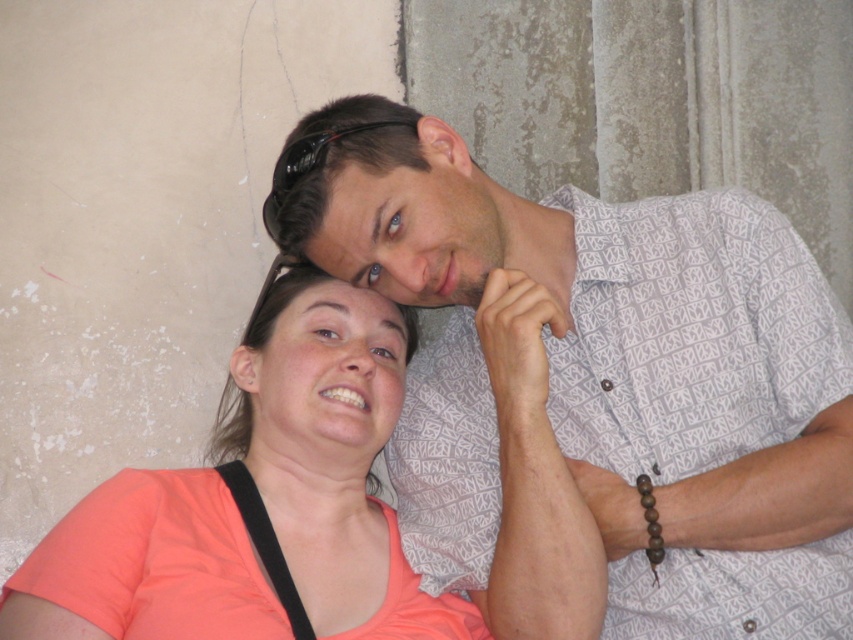
You are standing in front of the image and want to touch the two points mentioned. Which point, point (640, 534) or point (231, 515), would you reach first if you extend your hand towards them?

Point (640, 534) is closer to the viewer than point (231, 515), so you would reach point (640, 534) first.

You are a photographer setting up a photo shoot. You need to position a backdrop that is 1.8 meters tall. The backdrop must be placed so that it reaches from the top of the white printed shirt at upper center to the bottom of the coral matte shirt at center. Will the backdrop be tall enough to cover both shirts completely?

The white printed shirt at upper center is taller than the coral matte shirt at center. Since the backdrop is 1.8 meters tall, it should be sufficient to cover both shirts from top to bottom as long as their combined height does not exceed 1.8 meters. However, without specific measurements of each shirt, we cannot confirm definitively. The description only states the white printed shirt is taller, but not by how much.

You are a photographer setting up a photo shoot. You have two shirts to choose from for the main outfit in the scene described. The white printed shirt at upper center and the coral matte shirt at center. Based on their sizes, which shirt would you recommend to ensure it stands out more in the photo?

The white printed shirt at upper center is larger in size than the coral matte shirt at center, so it would stand out more in the photo.